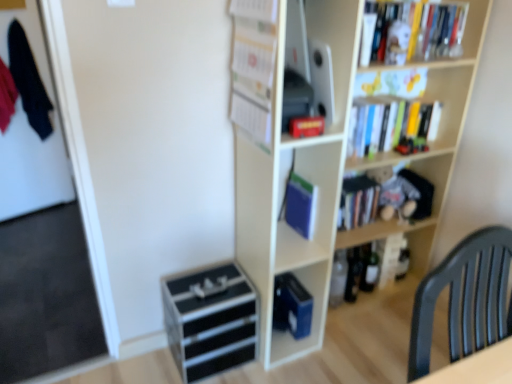
Question: Is green glass bottle at lower right, marked as the first beer bottle in a right-to-left arrangement, taller or shorter than hardcover book at center, the first book from the bottom?

Choices:
 (A) tall
 (B) short

Answer: (A)

Question: From the image's perspective, is green glass bottle at lower right, marked as the first beer bottle in a right-to-left arrangement, located above or below hardcover book at center, the first book from the bottom?

Choices:
 (A) below
 (B) above

Answer: (A)

Question: Estimate the real-world distances between objects in this image. Which object is farther from the blue matte book at center, which ranks as the second paperback book in back-to-front order?

Choices:
 (A) blue matte book at center, the first paperback book ordered from the bottom
 (B) hardcover book at center, the second book in the left-to-right sequence
 (C) dark blue fabric at left
 (D) hardcover books at upper right
 (E) plush gray bear at upper right

Answer: (C)

Question: Which object is positioned farthest from the white paper calendar at upper center, the 2th book in the bottom-to-top sequence?

Choices:
 (A) blue matte book at center, which is the first paperback book in top-to-bottom order
 (B) green glass bottle at lower right, which appears as the 2th beer bottle when viewed from the left
 (C) blue matte book at center, acting as the second paperback book starting from the front
 (D) matte black speaker at upper center
 (E) black plastic drawer at lower center

Answer: (B)